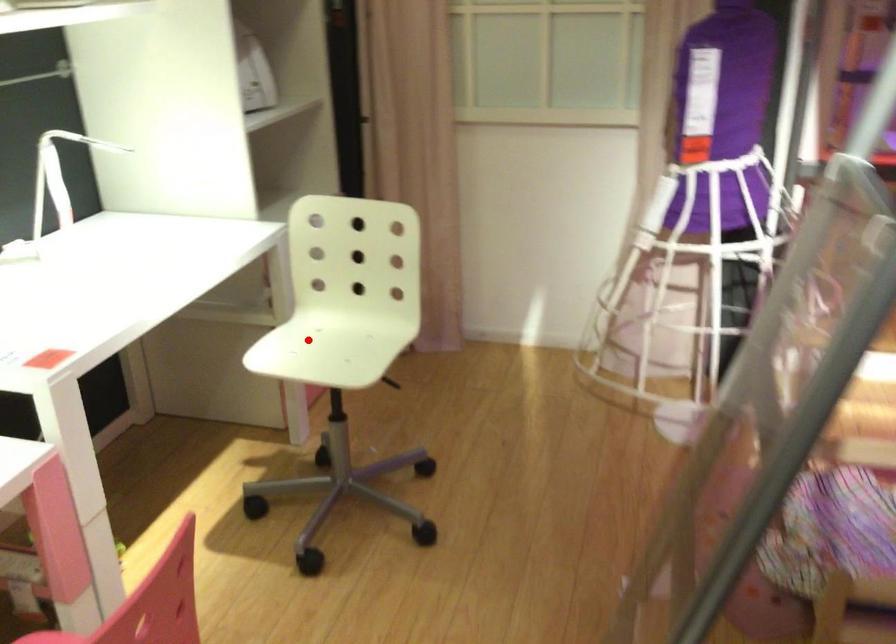
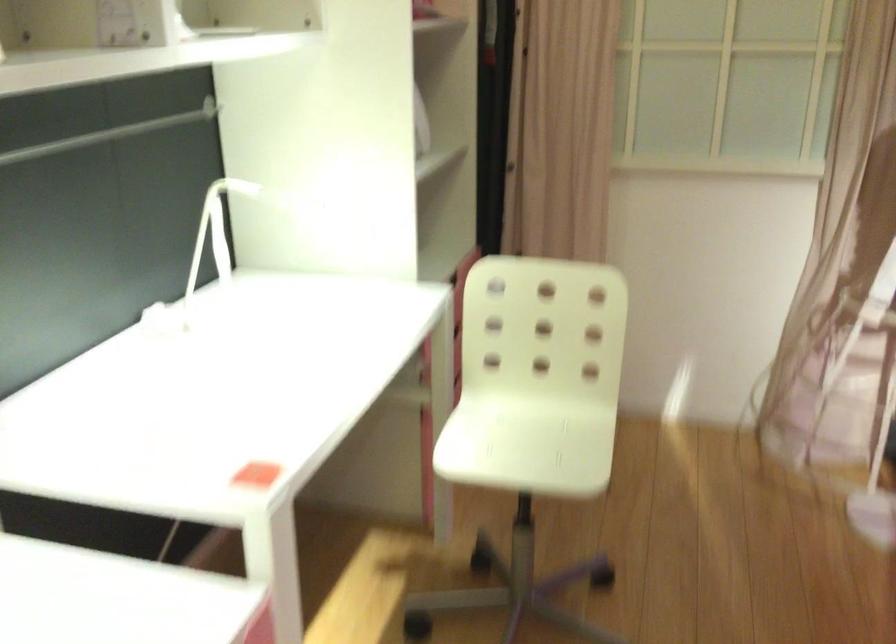
Question: A red point is marked in image1. In image2, is the corresponding 3D point closer to the camera or farther? Reply with the corresponding letter.

Choices:
 (A) The corresponding 3D point is closer.
 (B) The corresponding 3D point is farther.

Answer: (A)